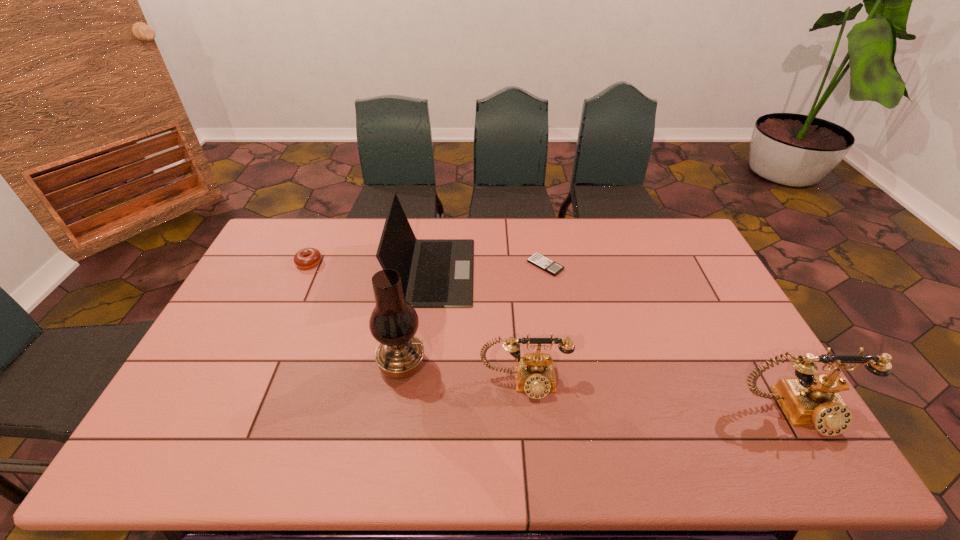
Locate an element on the screen. free space located on the right of the shortest object is located at coordinates (581, 266).

In order to click on free space located 0.090m on the screen of the laptop in this screenshot , I will do `click(499, 271)`.

Locate an element on the screen. This screenshot has height=540, width=960. vacant region located 0.060m on the right of the tallest object is located at coordinates (447, 365).

The height and width of the screenshot is (540, 960). I want to click on vacant space located 0.330m on the front of the doughnut, so click(272, 345).

The width and height of the screenshot is (960, 540). I want to click on calculator located at the far edge, so click(538, 260).

The height and width of the screenshot is (540, 960). Identify the location of laptop that is positioned at the far edge. (434, 272).

Identify the location of doughnut that is at the far edge. (308, 257).

You are a GUI agent. You are given a task and a screenshot of the screen. Output one action in this format:
    pyautogui.click(x=<x>, y=<y>)
    Task: Click on the object located in the left edge section of the desktop
    The height and width of the screenshot is (540, 960).
    Given the screenshot: What is the action you would take?
    pyautogui.click(x=308, y=257)

Identify the location of object that is at the right edge. (812, 399).

This screenshot has height=540, width=960. In order to click on object that is at the far left corner in this screenshot , I will do `click(308, 257)`.